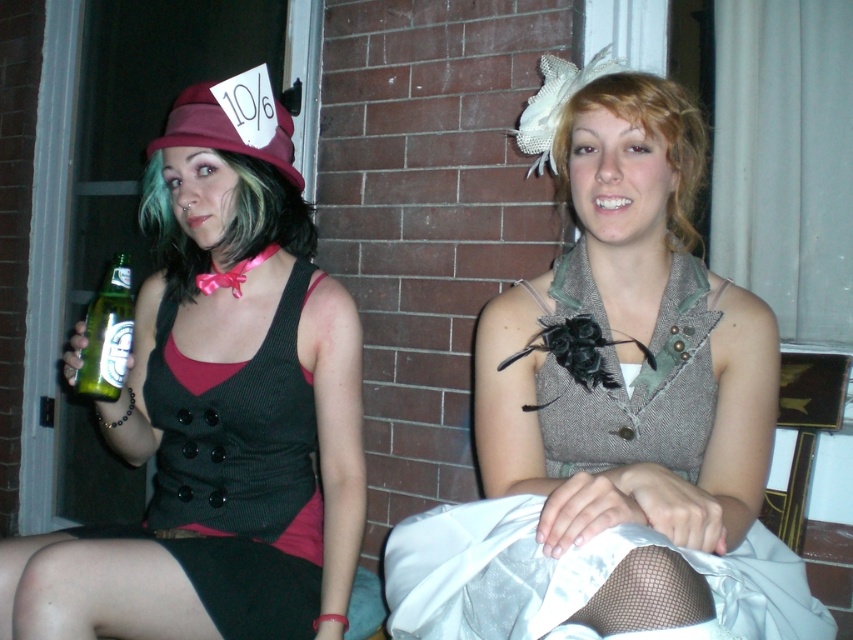
Which is in front, point (113, 259) or point (177, 122)?

Point (113, 259)

Who is positioned more to the left, green glass bottle at lower left or matte burgundy fabric hat at upper left?

green glass bottle at lower left is more to the left.

Identify the location of green glass bottle at lower left. (107, 333).

How much distance is there between textured gray vest at center and green glass bottle at lower left?

A distance of 58.59 centimeters exists between textured gray vest at center and green glass bottle at lower left.

Is textured gray vest at center to the right of green glass bottle at lower left from the viewer's perspective?

Correct, you'll find textured gray vest at center to the right of green glass bottle at lower left.

Does point (639, 292) come in front of point (123, 266)?

Yes, point (639, 292) is closer to viewer.

Locate an element on the screen. The image size is (853, 640). textured gray vest at center is located at coordinates (612, 410).

Can you confirm if textured gray vest at center is wider than matte black vest at center?

Yes.

Can you confirm if textured gray vest at center is positioned above matte black vest at center?

Indeed, textured gray vest at center is positioned over matte black vest at center.

Between point (682, 627) and point (207, 515), which one is positioned in front?

Positioned in front is point (682, 627).

Where is `textured gray vest at center`? This screenshot has height=640, width=853. textured gray vest at center is located at coordinates (612, 410).